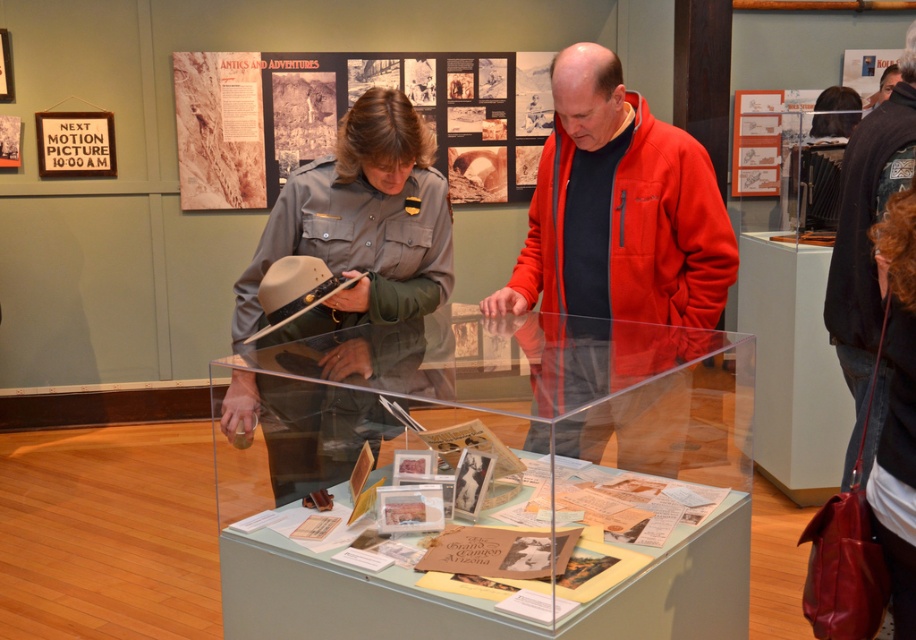
Question: Which object appears farthest from the camera in this image?

Choices:
 (A) black woolen jacket at upper right
 (B) gray uniform at center
 (C) red fleece jacket at center
 (D) clear acrylic display case at center

Answer: (A)

Question: Which of the following is the farthest from the observer?

Choices:
 (A) black woolen jacket at upper right
 (B) gray uniform at center

Answer: (A)

Question: Can you confirm if red fleece jacket at center is positioned to the right of black woolen jacket at upper right?

Choices:
 (A) no
 (B) yes

Answer: (A)

Question: Which of the following is the farthest from the observer?

Choices:
 (A) (869, 244)
 (B) (407, 253)
 (C) (361, 340)
 (D) (720, 266)

Answer: (A)

Question: Does clear acrylic display case at center have a larger size compared to red fleece jacket at center?

Choices:
 (A) yes
 (B) no

Answer: (A)

Question: Considering the relative positions of gray uniform at center and red fleece jacket at center in the image provided, where is gray uniform at center located with respect to red fleece jacket at center?

Choices:
 (A) above
 (B) below

Answer: (B)